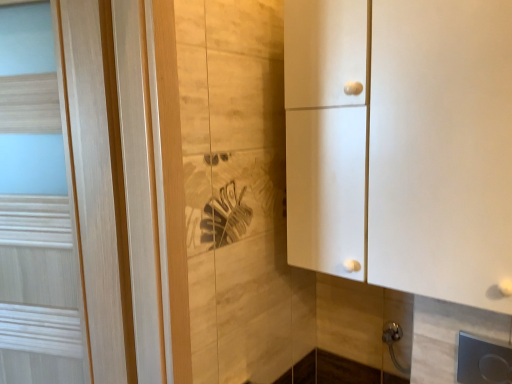
Question: Considering the relative sizes of light wood door at left and white matte cabinet at right in the image provided, is light wood door at left wider than white matte cabinet at right?

Choices:
 (A) yes
 (B) no

Answer: (B)

Question: Does light wood door at left turn towards white matte cabinet at right?

Choices:
 (A) yes
 (B) no

Answer: (B)

Question: Is white matte cabinet at right inside light wood door at left?

Choices:
 (A) no
 (B) yes

Answer: (A)

Question: Is light wood door at left closer to camera compared to white matte cabinet at right?

Choices:
 (A) no
 (B) yes

Answer: (A)

Question: Does light wood door at left have a lesser width compared to white matte cabinet at right?

Choices:
 (A) yes
 (B) no

Answer: (A)

Question: Is white matte cabinet at right to the left or to the right of light wood door at left in the image?

Choices:
 (A) right
 (B) left

Answer: (A)

Question: Is point (495, 235) closer or farther from the camera than point (31, 84)?

Choices:
 (A) closer
 (B) farther

Answer: (A)

Question: Considering the positions of white matte cabinet at right and light wood door at left in the image, is white matte cabinet at right wider or thinner than light wood door at left?

Choices:
 (A) thin
 (B) wide

Answer: (B)

Question: Choose the correct answer: Is white matte cabinet at right inside light wood door at left or outside it?

Choices:
 (A) outside
 (B) inside

Answer: (A)

Question: From a real-world perspective, is light wood door at left positioned above or below metallic silver door handle at lower right?

Choices:
 (A) below
 (B) above

Answer: (B)

Question: Choose the correct answer: Is light wood door at left inside metallic silver door handle at lower right or outside it?

Choices:
 (A) outside
 (B) inside

Answer: (A)

Question: Visually, is light wood door at left positioned to the left or to the right of metallic silver door handle at lower right?

Choices:
 (A) left
 (B) right

Answer: (A)

Question: Is light wood door at left taller or shorter than metallic silver door handle at lower right?

Choices:
 (A) tall
 (B) short

Answer: (A)

Question: Is white matte cabinet at right taller or shorter than metallic silver door handle at lower right?

Choices:
 (A) tall
 (B) short

Answer: (A)

Question: From the image's perspective, is white matte cabinet at right located above or below metallic silver door handle at lower right?

Choices:
 (A) below
 (B) above

Answer: (B)